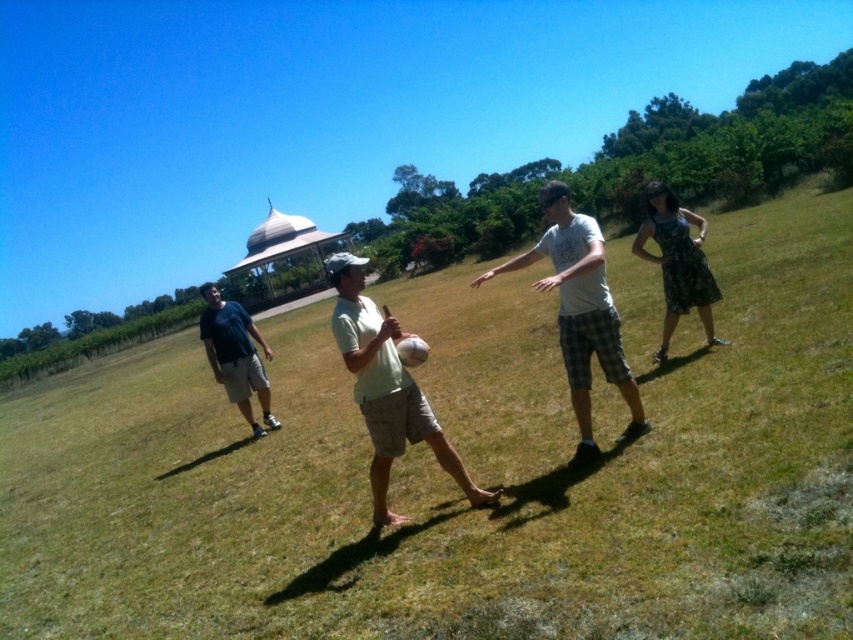
Identify the location of green grassy field at center. (468, 467).

This screenshot has width=853, height=640. I want to click on green grassy field at center, so click(468, 467).

Is green grassy field at center shorter than dark blue t-shirt at left?

In fact, green grassy field at center may be taller than dark blue t-shirt at left.

Can you confirm if green grassy field at center is smaller than dark blue t-shirt at left?

Actually, green grassy field at center might be larger than dark blue t-shirt at left.

Find the location of a particular element. The height and width of the screenshot is (640, 853). green grassy field at center is located at coordinates (468, 467).

The width and height of the screenshot is (853, 640). Describe the element at coordinates (579, 312) in the screenshot. I see `white cotton shirt at center` at that location.

Which is in front, point (585, 449) or point (241, 326)?

Point (585, 449) is more forward.

Who is more distant from viewer, (595, 289) or (257, 429)?

Positioned behind is point (257, 429).

The image size is (853, 640). I want to click on white cotton shirt at center, so click(579, 312).